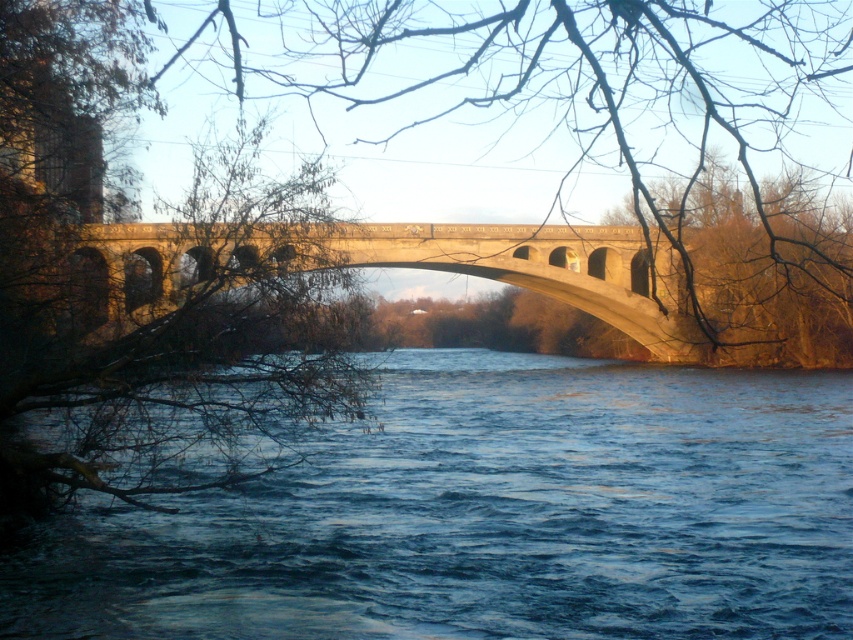
From the picture: Between blue water at center and brown textured tree at center, which one appears on the left side from the viewer's perspective?

blue water at center

Is point (675, 420) farther from camera compared to point (808, 305)?

That is False.

Where is `blue water at center`? Image resolution: width=853 pixels, height=640 pixels. blue water at center is located at coordinates (490, 516).

Is concrete bridge at center below brown textured tree at center?

Yes.

This screenshot has height=640, width=853. I want to click on concrete bridge at center, so click(x=407, y=264).

Where is `concrete bridge at center`? The height and width of the screenshot is (640, 853). concrete bridge at center is located at coordinates (407, 264).

Which of these two, brown leafless branches at left or brown textured tree at center, stands shorter?

brown leafless branches at left

Does brown leafless branches at left appear on the right side of brown textured tree at center?

Incorrect, brown leafless branches at left is not on the right side of brown textured tree at center.

Which is behind, point (113, 484) or point (730, 284)?

The point (730, 284) is behind.

Locate an element on the screen. The height and width of the screenshot is (640, 853). brown leafless branches at left is located at coordinates (131, 301).